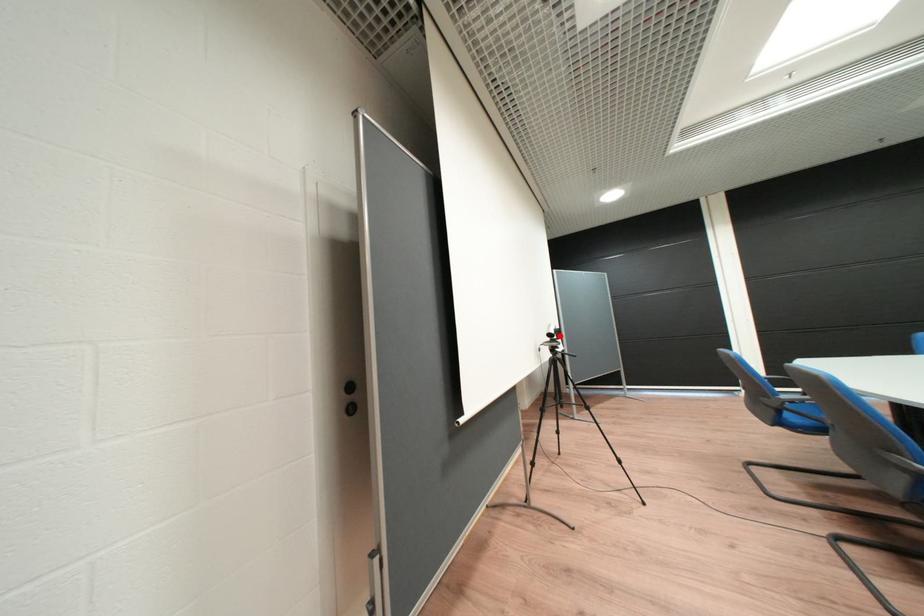
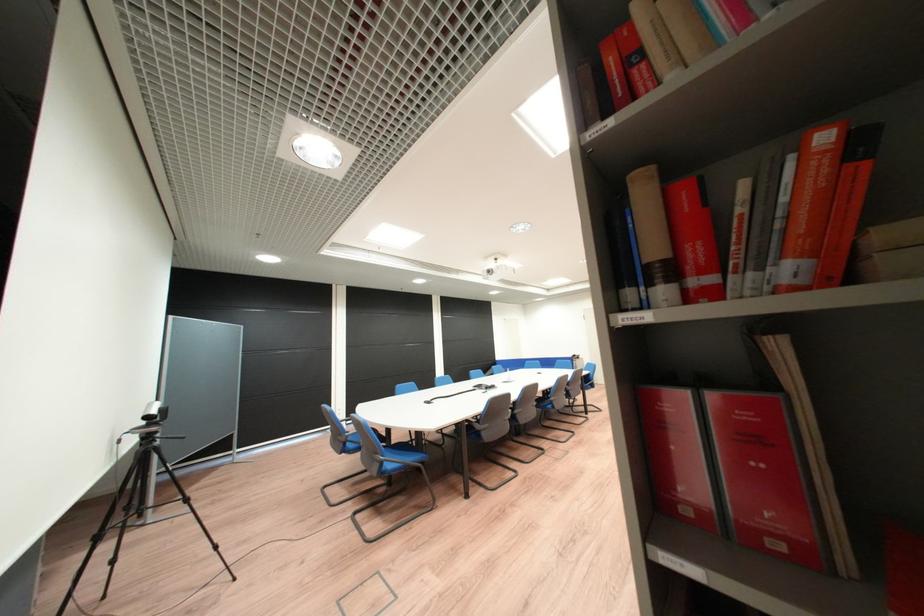
Find the pixel in the second image that matches the highlighted location in the first image.

(159, 418)